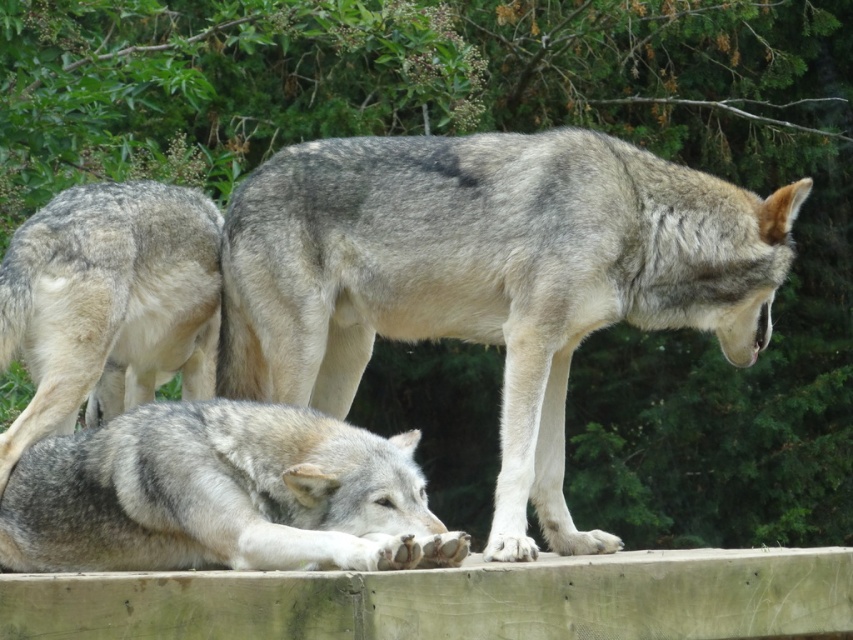
Looking at this image, you are a wildlife photographer trying to capture a photo of the gray fur wolf at center and gray fur wolf at lower left. Your camera has a maximum focus range of 8 feet. Can you take a photo of both wolves at the same time without moving the camera?

The gray fur wolf at center is 9.12 feet from the gray fur wolf at lower left, which is beyond the camera maximum focus range of 8 feet. Therefore, you cannot take a photo of both wolves at the same time without moving the camera.

You are a wildlife photographer observing the wolves in the enclosure. You want to capture a photo of the gray fur wolf at center and the gray fur wolf at lower left. Based on their positions, which wolf is positioned higher in the frame?

The gray fur wolf at center is positioned higher in the frame than the gray fur wolf at lower left because it is located above it according to the description.

You are a wildlife photographer trying to capture a closeup of the gray fur wolf at lower left and the fuzzy gray fur at lower left. Since your camera has a limited focus range, you need to know which one is wider. Which one has a greater width?

The gray fur wolf at lower left has a greater width than the fuzzy gray fur at lower left according to the description.